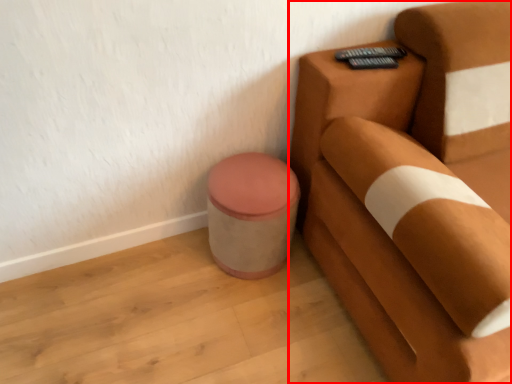
Question: In this image, where is furniture (annotated by the red box) located relative to potty?

Choices:
 (A) left
 (B) right

Answer: (B)